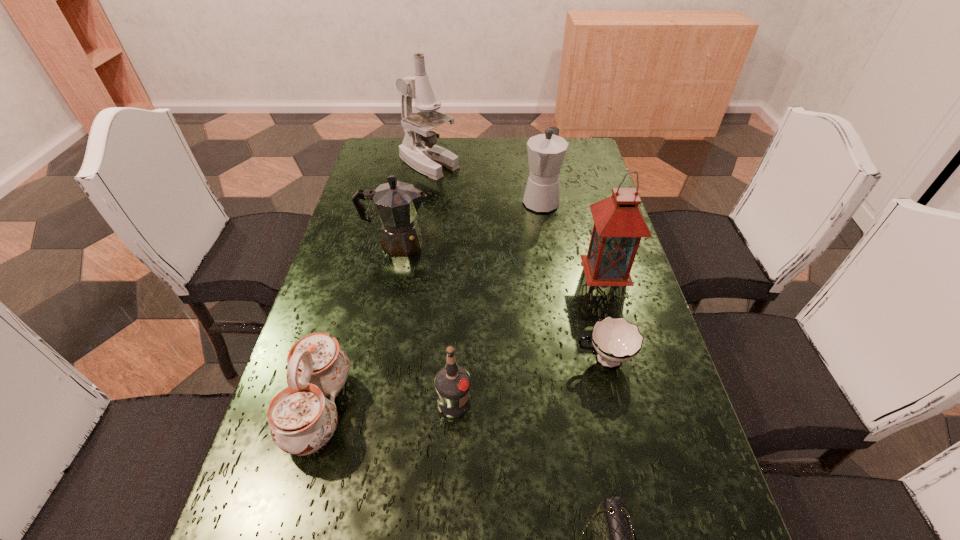
Where is `the tallest object`? The height and width of the screenshot is (540, 960). the tallest object is located at coordinates (418, 149).

What are the coordinates of `the farthest object` in the screenshot? It's located at (418, 149).

Locate an element on the screen. The height and width of the screenshot is (540, 960). lantern is located at coordinates (619, 225).

I want to click on the right coffeepot, so click(x=546, y=152).

Locate an element on the screen. Image resolution: width=960 pixels, height=540 pixels. the second farthest object is located at coordinates (546, 152).

Image resolution: width=960 pixels, height=540 pixels. Find the location of `the nearer coffeepot`. the nearer coffeepot is located at coordinates (397, 203).

Locate an element on the screen. The image size is (960, 540). vodka is located at coordinates (452, 383).

Image resolution: width=960 pixels, height=540 pixels. In order to click on chinaware in this screenshot , I will do `click(302, 420)`.

Locate an element on the screen. The image size is (960, 540). cup is located at coordinates (615, 340).

Find the location of a particular element. The width and height of the screenshot is (960, 540). vacant space situated 0.350m on the right of the tallest object is located at coordinates click(558, 164).